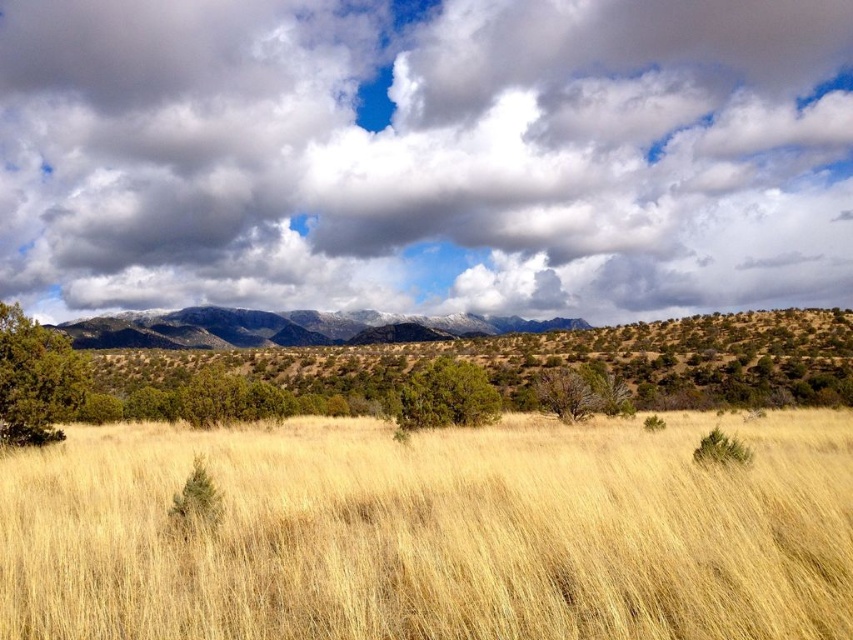
Can you confirm if green textured bush at left is positioned below green matte bush at center?

Incorrect, green textured bush at left is not positioned below green matte bush at center.

Is point (25, 353) positioned before point (473, 412)?

Yes, it is in front of point (473, 412).

Where is `green textured bush at left`? The image size is (853, 640). green textured bush at left is located at coordinates (36, 380).

Does point (280, 362) lie in front of point (415, 401)?

No.

The height and width of the screenshot is (640, 853). I want to click on green shrub at center, so click(x=498, y=369).

Does snow-covered rock at upper center have a lesser height compared to green matte bush at center?

No.

Does snow-covered rock at upper center lie behind green matte bush at center?

Yes, it is behind green matte bush at center.

Is point (260, 337) positioned behind point (479, 378)?

Yes, point (260, 337) is farther from viewer.

Find the location of `snow-covered rock at upper center`. snow-covered rock at upper center is located at coordinates (288, 326).